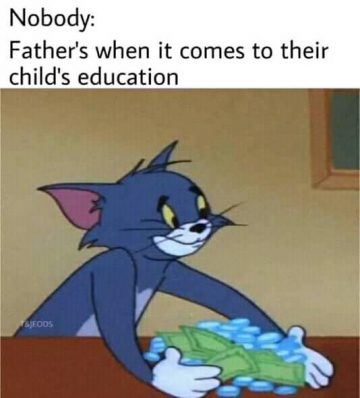
Find the location of a particular element. This screenshot has width=360, height=398. wall is located at coordinates coord(211,155).